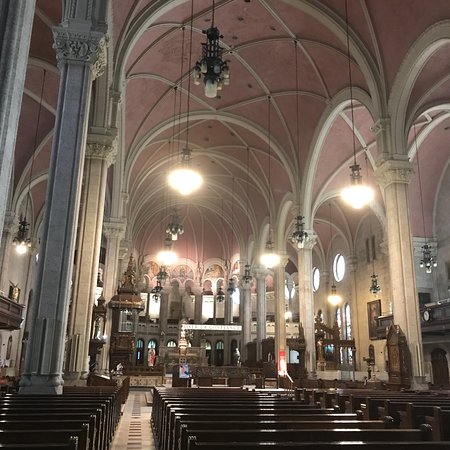
You are a GUI agent. You are given a task and a screenshot of the screen. Output one action in this format:
    pyautogui.click(x=<x>, y=<y>)
    Task: Click on the statue
    
    Given the screenshot: What is the action you would take?
    pyautogui.click(x=150, y=358)